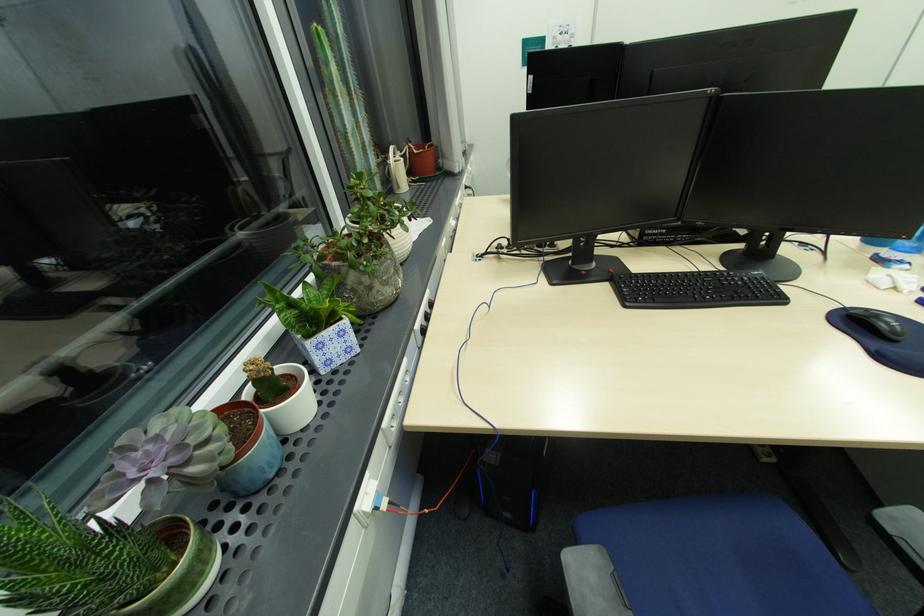
Find the location of a particular element. The height and width of the screenshot is (616, 924). mouse left button is located at coordinates (861, 318).